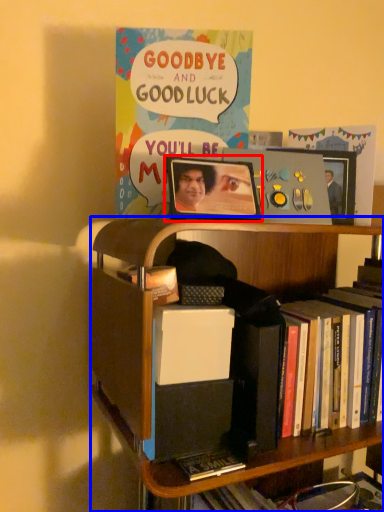
Question: Which of the following is the farthest to the observer, picture frame (highlighted by a red box) or bookcase (highlighted by a blue box)?

Choices:
 (A) picture frame
 (B) bookcase

Answer: (A)